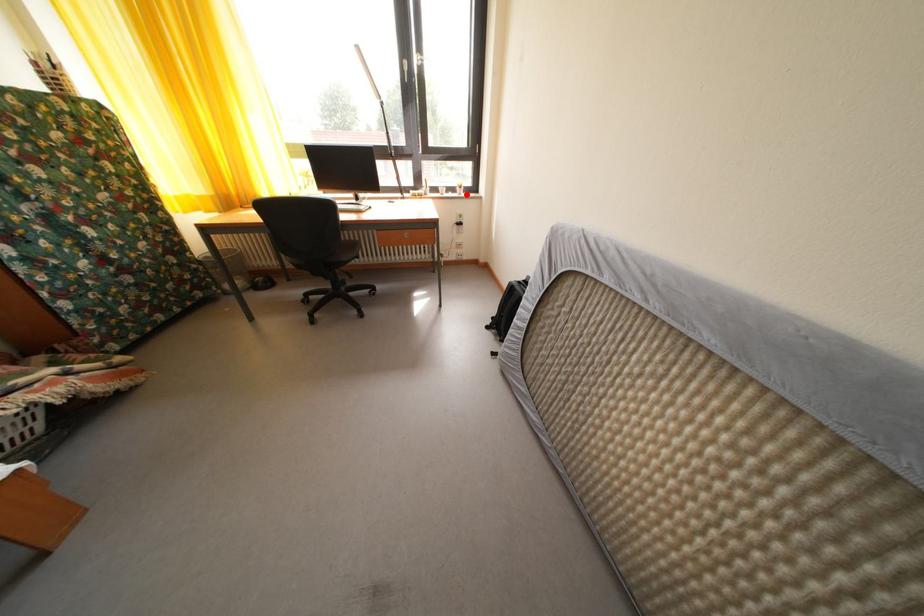
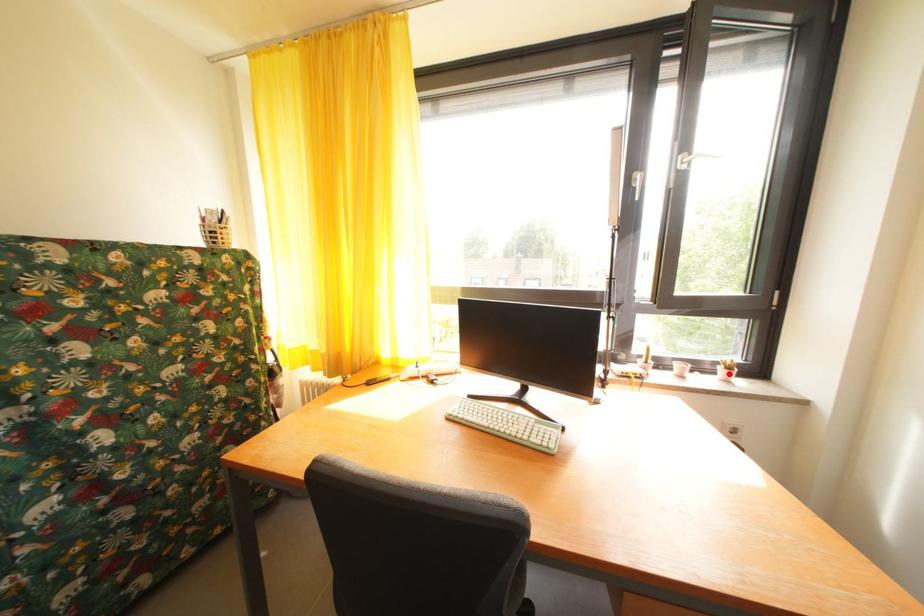
I am providing you with two images of the same scene from different viewpoints. A red point is marked on the first image and another point is marked on the second image. Do the highlighted points in image1 and image2 indicate the same real-world spot?

Yes